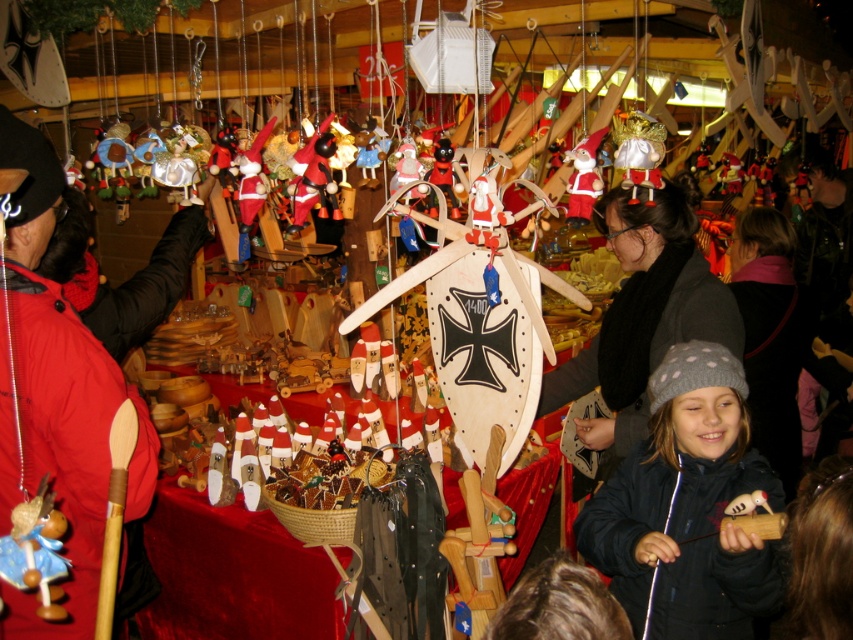
Question: Is red woolen hat at upper center further to camera compared to velvet santa at center?

Choices:
 (A) yes
 (B) no

Answer: (B)

Question: Can you confirm if gray knit hat at center is wider than wooden rabbit at center?

Choices:
 (A) no
 (B) yes

Answer: (B)

Question: Does gray knit hat at center have a larger size compared to wooden santa at center?

Choices:
 (A) no
 (B) yes

Answer: (B)

Question: Which object is farther from the camera taking this photo?

Choices:
 (A) wooden rabbit at center
 (B) velvet santa at center
 (C) wooden santa at center
 (D) gray knit hat at center

Answer: (C)

Question: Which of the following is the closest to the observer?

Choices:
 (A) wooden santa at center
 (B) wooden rabbit at center
 (C) white satin bag at center
 (D) velvet santa at center

Answer: (B)

Question: Considering the real-world distances, which object is farthest from the wooden shield at center?

Choices:
 (A) gray knitted hat at lower right
 (B) white satin bag at center
 (C) gray knit hat at center
 (D) red woolen hat at upper center

Answer: (D)